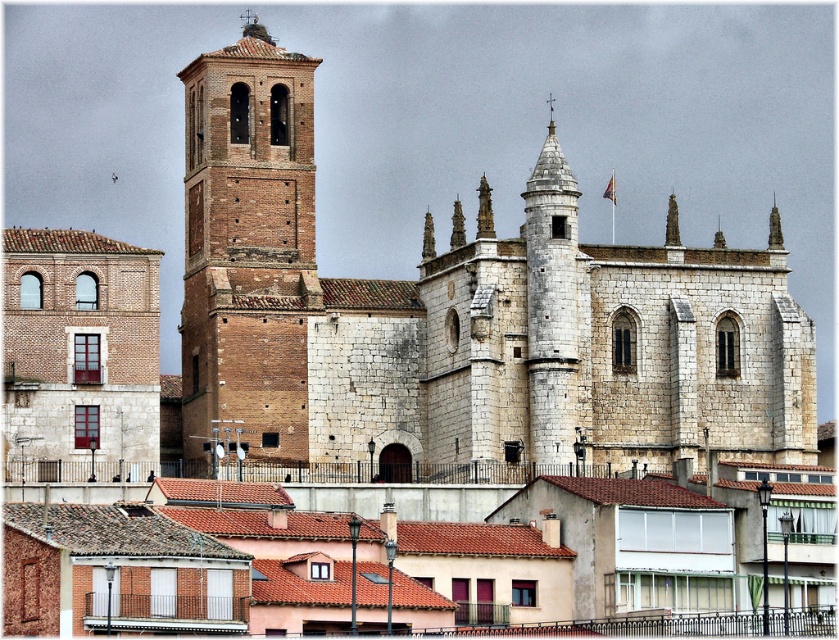
Question: Does brick tower at upper left appear on the right side of brick tower at left?

Choices:
 (A) yes
 (B) no

Answer: (A)

Question: Among these points, which one is nearest to the camera?

Choices:
 (A) (219, 301)
 (B) (238, 173)

Answer: (A)

Question: Can you confirm if brick tower at upper left is thinner than brick tower at left?

Choices:
 (A) yes
 (B) no

Answer: (B)

Question: Is brick tower at upper left positioned behind brick tower at left?

Choices:
 (A) yes
 (B) no

Answer: (B)